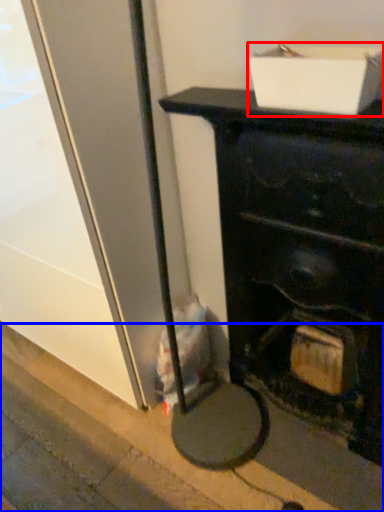
Question: Which object appears closest to the camera in this image, cardboard box (highlighted by a red box) or pavement (highlighted by a blue box)?

Choices:
 (A) cardboard box
 (B) pavement

Answer: (A)